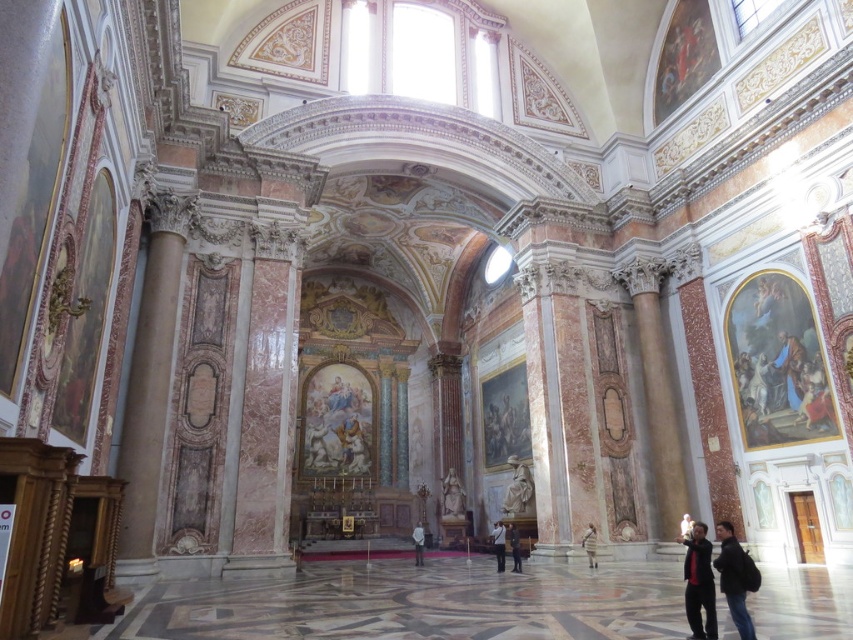
Question: In this image, where is dark blue jacket at lower right located relative to light gray fabric jacket at center?

Choices:
 (A) left
 (B) right

Answer: (B)

Question: Which of the following is the closest to the observer?

Choices:
 (A) (492, 536)
 (B) (418, 564)
 (C) (711, 572)
 (D) (685, 515)

Answer: (C)

Question: Among these objects, which one is nearest to the camera?

Choices:
 (A) dark gray fabric jacket at center
 (B) matte white statue at center
 (C) light beige fabric coat at lower right
 (D) light gray fabric jacket at center

Answer: (A)

Question: Considering the relative positions of light beige fabric coat at lower right and light brown leather jacket at center in the image provided, where is light beige fabric coat at lower right located with respect to light brown leather jacket at center?

Choices:
 (A) right
 (B) left

Answer: (B)

Question: Does dark gray fabric jacket at center have a lesser width compared to light brown leather jacket at center?

Choices:
 (A) yes
 (B) no

Answer: (A)

Question: Considering the real-world distances, which object is closest to the dark blue jeans at lower center?

Choices:
 (A) dark gray fabric jacket at center
 (B) dark red fabric jacket at lower right
 (C) light brown leather jacket at center
 (D) matte white statue at center

Answer: (A)